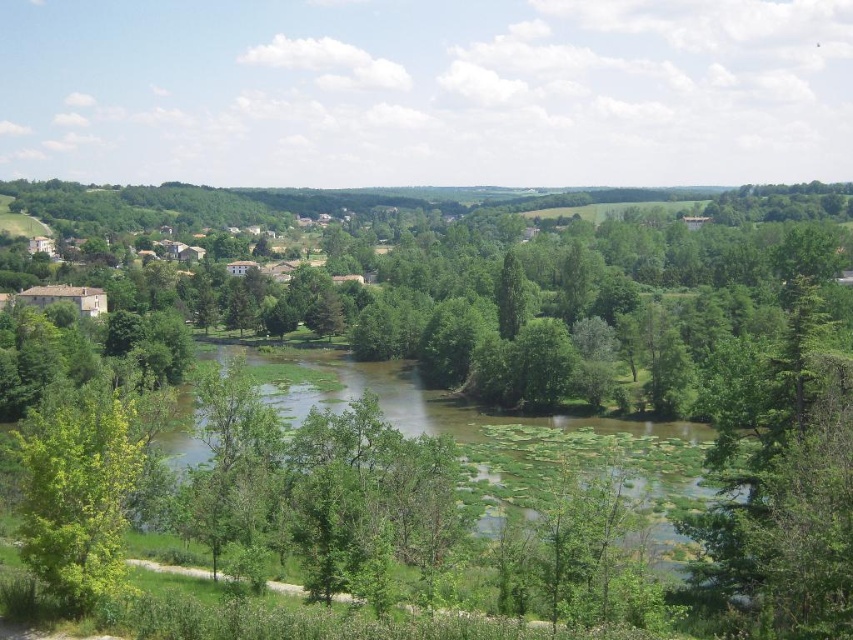
How distant is green leafy tree at center from green leafy tree at lower left?

50.56 meters

Measure the distance from green leafy tree at center to green leafy tree at lower left.

A distance of 50.56 meters exists between green leafy tree at center and green leafy tree at lower left.

Image resolution: width=853 pixels, height=640 pixels. Describe the element at coordinates (785, 461) in the screenshot. I see `green leafy tree at center` at that location.

Identify the location of green leafy tree at center. (785, 461).

Is green leafy river at center thinner than green leafy tree at lower left?

Incorrect, green leafy river at center's width is not less than green leafy tree at lower left's.

Who is positioned more to the right, green leafy river at center or green leafy tree at lower left?

Positioned to the right is green leafy river at center.

The height and width of the screenshot is (640, 853). What are the coordinates of `green leafy river at center` in the screenshot? It's located at (502, 432).

This screenshot has height=640, width=853. Identify the location of green leafy river at center. (502, 432).

Between green leafy tree at center and green leafy river at center, which one is positioned higher?

green leafy tree at center

Consider the image. Who is taller, green leafy tree at center or green leafy river at center?

green leafy tree at center is taller.

Who is more distant from viewer, (811,547) or (581,440)?

Point (581,440)

Locate an element on the screen. The height and width of the screenshot is (640, 853). green leafy tree at center is located at coordinates 785,461.